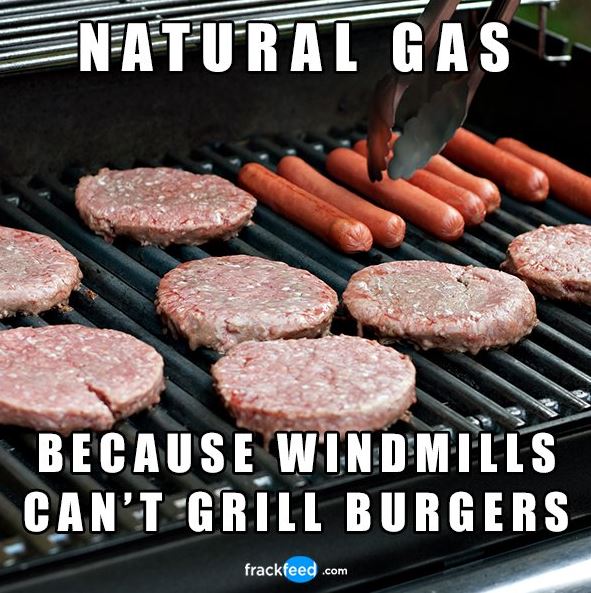
The height and width of the screenshot is (593, 591). Identify the location of left prong handle. (431, 12).